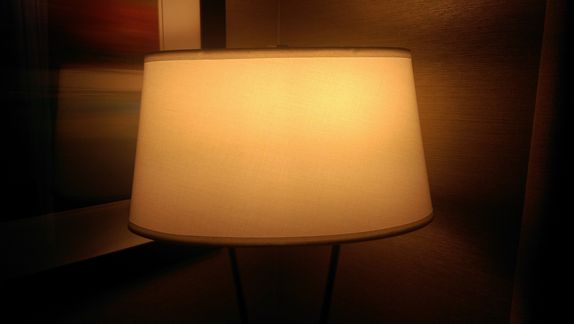
Identify the location of lamp. (279, 286).